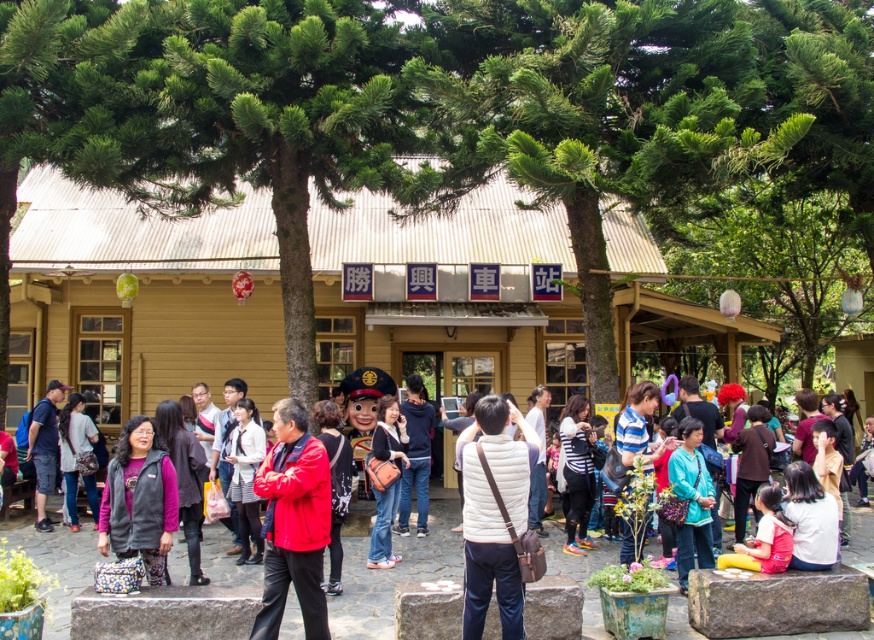
Measure the distance between red matte jacket at center and camera.

A distance of 5.63 meters exists between red matte jacket at center and camera.

Which is in front, point (268, 634) or point (49, 467)?

Point (268, 634) is more forward.

In order to click on red matte jacket at center in this screenshot , I will do `click(293, 522)`.

Is dark gray fleece vest at center to the right of striped cotton shirt at center from the viewer's perspective?

No, dark gray fleece vest at center is not to the right of striped cotton shirt at center.

Is point (171, 490) more distant than point (632, 420)?

No, it is not.

Where is `dark gray fleece vest at center`? This screenshot has height=640, width=874. dark gray fleece vest at center is located at coordinates pos(139,499).

The width and height of the screenshot is (874, 640). I want to click on dark gray fleece vest at center, so click(139, 499).

Is green textured tree at center taller than red matte jacket at center?

Indeed, green textured tree at center has a greater height compared to red matte jacket at center.

Who is more distant from viewer, (114, 129) or (300, 499)?

The point (114, 129) is more distant.

At what (x,y) coordinates should I click in order to perform the action: click on green textured tree at center. Please return your answer as a coordinate pair (x, y). Looking at the image, I should click on (262, 116).